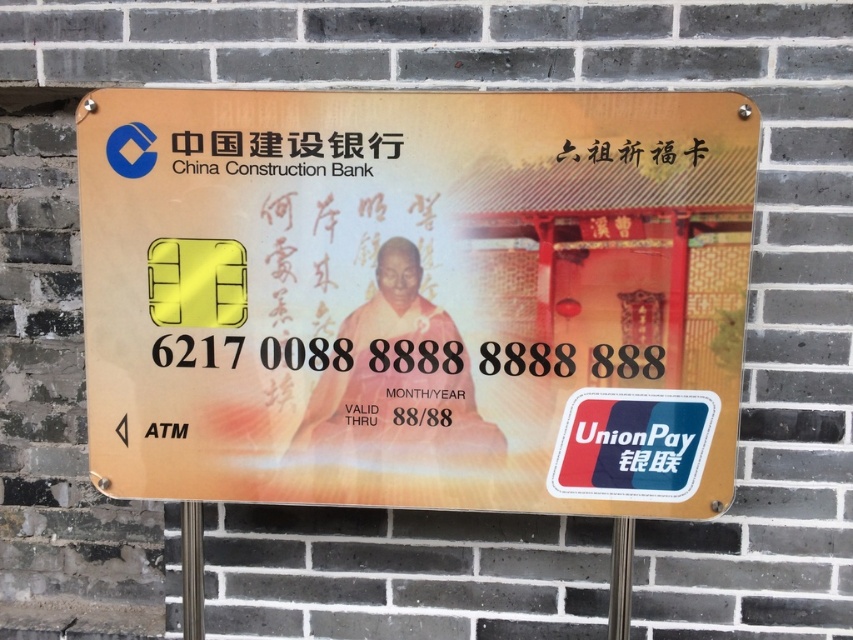
Is point (332, 147) farther from viewer compared to point (199, 515)?

No, (332, 147) is closer to viewer.

Does black plastic text at upper center appear on the right side of metallic pole at lower center?

Indeed, black plastic text at upper center is positioned on the right side of metallic pole at lower center.

Which is behind, point (202, 147) or point (184, 612)?

Point (184, 612)

The width and height of the screenshot is (853, 640). What are the coordinates of `black plastic text at upper center` in the screenshot? It's located at (323, 145).

Can you confirm if metallic pole at lower center is taller than metallic pole at center?

No, metallic pole at lower center is not taller than metallic pole at center.

Who is positioned more to the left, metallic pole at lower center or metallic pole at center?

Positioned to the left is metallic pole at lower center.

Who is more forward, [184,500] or [631,547]?

Point [184,500]

Find the location of a particular element. metallic pole at lower center is located at coordinates (190, 570).

Is black plastic text at upper center to the right of metallic pole at center from the viewer's perspective?

No, black plastic text at upper center is not to the right of metallic pole at center.

Can you confirm if black plastic text at upper center is smaller than metallic pole at center?

Correct, black plastic text at upper center occupies less space than metallic pole at center.

The image size is (853, 640). Identify the location of black plastic text at upper center. (323, 145).

I want to click on black plastic text at upper center, so coord(323,145).